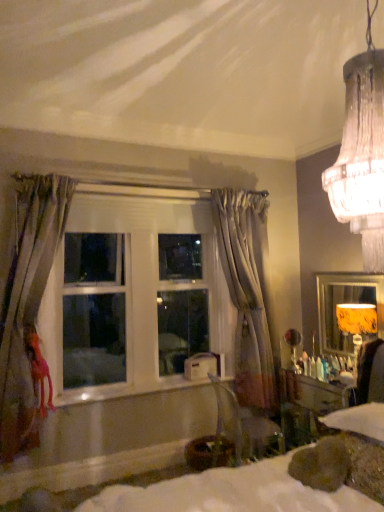
This screenshot has width=384, height=512. Describe the element at coordinates (127, 390) in the screenshot. I see `white glossy window sill at center` at that location.

In order to face white glossy window at center, should I rotate leftwards or rightwards?

Turn left by 6.479 degrees to look at white glossy window at center.

Where is `velvet gray armchair at lower right`? The width and height of the screenshot is (384, 512). velvet gray armchair at lower right is located at coordinates (246, 426).

The image size is (384, 512). What do you see at coordinates (362, 154) in the screenshot? I see `crystal chandelier at upper right` at bounding box center [362, 154].

At what (x,y) coordinates should I click in order to perform the action: click on silky gray curtain at left, positioned as the 1th curtain in left-to-right order. Please return your answer as a coordinate pair (x, y). The width and height of the screenshot is (384, 512). Looking at the image, I should click on (29, 310).

Locate an element on the screen. This screenshot has height=512, width=384. white glossy window sill at center is located at coordinates (127, 390).

Considering the sizes of objects white glossy window sill at center and silky gray curtain at center, which appears as the second curtain when viewed from the front, in the image provided, who is taller, white glossy window sill at center or silky gray curtain at center, which appears as the second curtain when viewed from the front,?

Standing taller between the two is silky gray curtain at center, which appears as the second curtain when viewed from the front.

Identify the location of curtain on the right of the white glossy window sill at center. (248, 294).

Looking at this image, is white glossy window sill at center positioned with its back to silky gray curtain at center, positioned as the first curtain in right-to-left order?

No.

In terms of height, does yellow fabric lampshade at right look taller or shorter compared to white glossy window at center?

Considering their sizes, yellow fabric lampshade at right has less height than white glossy window at center.

Is yellow fabric lampshade at right closer to camera compared to white glossy window at center?

No, it is not.

What are the coordinates of `mirror on the right of the white glossy window at center` in the screenshot? It's located at (348, 309).

Is yellow fabric lampshade at right oriented away from white glossy window at center?

yellow fabric lampshade at right is not turned away from white glossy window at center.

Which object is positioned more to the left, velvet gray armchair at lower right or silky gray curtain at left, positioned as the 1th curtain in left-to-right order?

silky gray curtain at left, positioned as the 1th curtain in left-to-right order.

Does velvet gray armchair at lower right have a larger size compared to silky gray curtain at left, acting as the first curtain starting from the front?

No.

Is the surface of velvet gray armchair at lower right in direct contact with silky gray curtain at left, which ranks as the 2th curtain in back-to-front order?

No, velvet gray armchair at lower right is not touching silky gray curtain at left, which ranks as the 2th curtain in back-to-front order.

This screenshot has width=384, height=512. In order to click on curtain in front of the velvet gray armchair at lower right in this screenshot , I will do `click(29, 310)`.

From a real-world perspective, between white glossy window sill at center and orange fabric lampshade at right, who is vertically lower?

white glossy window sill at center.

Is white glossy window sill at center inside or outside of orange fabric lampshade at right?

white glossy window sill at center is outside orange fabric lampshade at right.

Is point (124, 386) closer to viewer compared to point (354, 346)?

Yes, it is in front of point (354, 346).

Considering the sizes of silky gray curtain at left, the 2th curtain positioned from the right, and silky gray curtain at center, the second curtain when ordered from left to right, in the image, is silky gray curtain at left, the 2th curtain positioned from the right, taller or shorter than silky gray curtain at center, the second curtain when ordered from left to right,?

In the image, silky gray curtain at left, the 2th curtain positioned from the right, appears to be shorter than silky gray curtain at center, the second curtain when ordered from left to right.

From the image's perspective, does silky gray curtain at left, which ranks as the 2th curtain in back-to-front order, appear higher than silky gray curtain at center, the second curtain when ordered from left to right?

No, from the image's perspective, silky gray curtain at left, which ranks as the 2th curtain in back-to-front order, is not above silky gray curtain at center, the second curtain when ordered from left to right.

Which object is wider, silky gray curtain at left, acting as the first curtain starting from the front, or silky gray curtain at center, the second curtain when ordered from left to right?

silky gray curtain at center, the second curtain when ordered from left to right.

Is white glossy window sill at center facing towards silky gray curtain at left, acting as the first curtain starting from the front?

No, white glossy window sill at center does not turn towards silky gray curtain at left, acting as the first curtain starting from the front.

Is white glossy window sill at center far from silky gray curtain at left, the 2th curtain positioned from the right?

Actually, white glossy window sill at center and silky gray curtain at left, the 2th curtain positioned from the right, are a little close together.

Which is in front, white glossy window sill at center or silky gray curtain at left, positioned as the 1th curtain in left-to-right order?

silky gray curtain at left, positioned as the 1th curtain in left-to-right order.

Between point (71, 397) and point (41, 271), which one is positioned behind?

Positioned behind is point (71, 397).

Considering the relative sizes of orange fabric lampshade at right and velvet gray armchair at lower right in the image provided, is orange fabric lampshade at right wider than velvet gray armchair at lower right?

No, orange fabric lampshade at right is not wider than velvet gray armchair at lower right.

Can you confirm if orange fabric lampshade at right is smaller than velvet gray armchair at lower right?

Indeed, orange fabric lampshade at right has a smaller size compared to velvet gray armchair at lower right.

Is velvet gray armchair at lower right at the back of orange fabric lampshade at right?

That's not correct — orange fabric lampshade at right is not looking away from velvet gray armchair at lower right.

Is orange fabric lampshade at right far away from velvet gray armchair at lower right?

Yes, orange fabric lampshade at right and velvet gray armchair at lower right are quite far apart.

At what (x,y) coordinates should I click in order to perform the action: click on window sill on the left of silky gray curtain at center, positioned as the first curtain in right-to-left order. Please return your answer as a coordinate pair (x, y). This screenshot has height=512, width=384. Looking at the image, I should click on (127, 390).

This screenshot has width=384, height=512. In the image, there is a white glossy window at center. Find the location of `mirror below it (from a real-world perspective)`. mirror below it (from a real-world perspective) is located at coordinates (348, 309).

From the picture: From the image, which object appears to be nearer to white fabric bed at lower center, yellow fabric lampshade at right or white glossy window sill at center?

Based on the image, white glossy window sill at center appears to be nearer to white fabric bed at lower center.

Based on their spatial positions, is silky gray curtain at center, positioned as the first curtain in right-to-left order, or orange fabric lampshade at right further from white fabric bed at lower center?

silky gray curtain at center, positioned as the first curtain in right-to-left order, is positioned further to the anchor white fabric bed at lower center.

When comparing their distances from crystal chandelier at upper right, does white glossy window at center or silky gray curtain at left, positioned as the 1th curtain in left-to-right order, seem closer?

Among the two, white glossy window at center is located nearer to crystal chandelier at upper right.

Based on their spatial positions, is yellow fabric lampshade at right or silky gray curtain at left, the 2th curtain positioned from the right, further from velvet gray armchair at lower right?

Among the two, silky gray curtain at left, the 2th curtain positioned from the right, is located further to velvet gray armchair at lower right.

Estimate the real-world distances between objects in this image. Which object is further from orange fabric lampshade at right, silky gray curtain at center, arranged as the 1th curtain when viewed from the back, or crystal chandelier at upper right?

crystal chandelier at upper right lies further to orange fabric lampshade at right than the other object.

Which object lies nearer to the anchor point silky gray curtain at left, which ranks as the 2th curtain in back-to-front order, white glossy window at center or silky gray curtain at center, which appears as the second curtain when viewed from the front?

white glossy window at center is positioned closer to the anchor silky gray curtain at left, which ranks as the 2th curtain in back-to-front order.

Looking at this image, when comparing their distances from white fabric bed at lower center, does white glossy window sill at center or crystal chandelier at upper right seem further?

Based on the image, crystal chandelier at upper right appears to be further to white fabric bed at lower center.

Looking at the image, which one is located further to silky gray curtain at left, which ranks as the 2th curtain in back-to-front order, crystal chandelier at upper right or white glossy window at center?

crystal chandelier at upper right.

Locate an element on the screen. The height and width of the screenshot is (512, 384). curtain located between white fabric bed at lower center and orange fabric lampshade at right in the depth direction is located at coordinates (29, 310).

Locate an element on the screen. window situated between silky gray curtain at left, positioned as the 1th curtain in left-to-right order, and velvet gray armchair at lower right from left to right is located at coordinates (136, 298).

Locate an element on the screen. light fixture between crystal chandelier at upper right and white glossy window sill at center along the z-axis is located at coordinates (357, 324).

The height and width of the screenshot is (512, 384). Find the location of `light fixture between white fabric bed at lower center and white glossy window at center along the z-axis`. light fixture between white fabric bed at lower center and white glossy window at center along the z-axis is located at coordinates (357, 324).